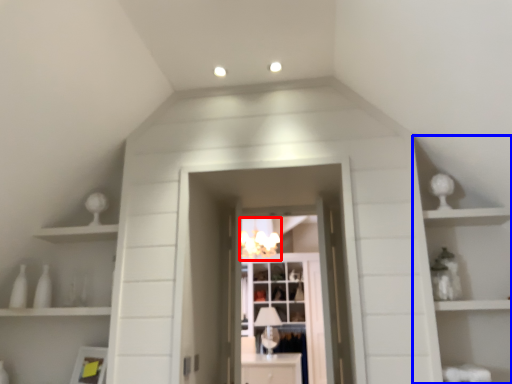
Question: Which object appears closest to the camera in this image, light fixture (highlighted by a red box) or cabinet (highlighted by a blue box)?

Choices:
 (A) light fixture
 (B) cabinet

Answer: (B)